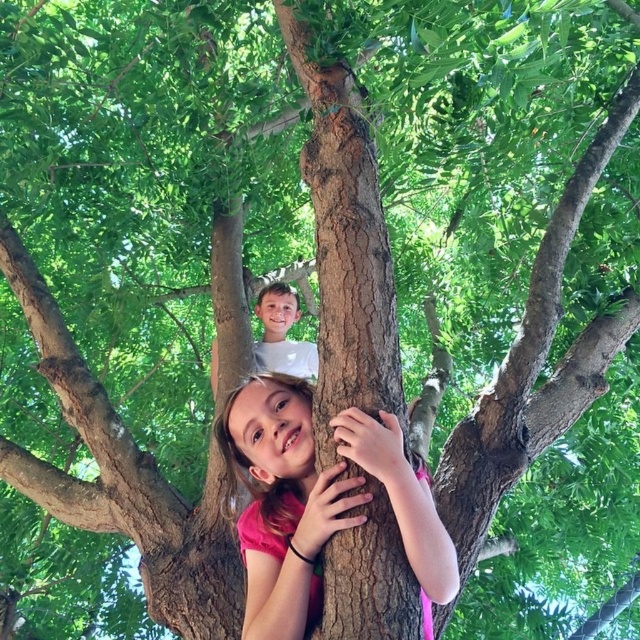
Question: Is pink matte shirt at center bigger than white matte shirt at upper center?

Choices:
 (A) no
 (B) yes

Answer: (A)

Question: Which object is closer to the camera taking this photo?

Choices:
 (A) white matte shirt at upper center
 (B) pink matte shirt at center

Answer: (B)

Question: Does pink matte shirt at center come in front of white matte shirt at upper center?

Choices:
 (A) yes
 (B) no

Answer: (A)

Question: Does pink matte shirt at center appear over white matte shirt at upper center?

Choices:
 (A) no
 (B) yes

Answer: (A)